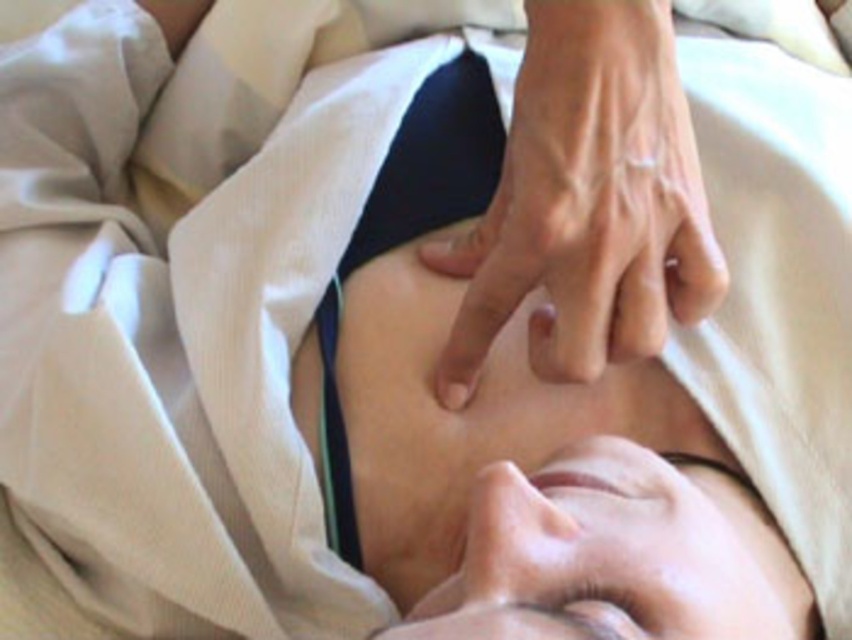
Which is behind, point (637, 192) or point (637, 614)?

Point (637, 192)

Based on the photo, which is more to the left, smooth skin hand at center or brown matte eye at upper center?

Positioned to the left is brown matte eye at upper center.

Image resolution: width=852 pixels, height=640 pixels. What do you see at coordinates (586, 202) in the screenshot?
I see `smooth skin hand at center` at bounding box center [586, 202].

The height and width of the screenshot is (640, 852). I want to click on smooth skin hand at center, so click(x=586, y=202).

Is point (545, 602) positioned after point (612, 611)?

Yes, point (545, 602) is behind point (612, 611).

Can you confirm if smooth skin head at center is thinner than brown matte eye at upper center?

In fact, smooth skin head at center might be wider than brown matte eye at upper center.

At what (x,y) coordinates should I click in order to perform the action: click on smooth skin head at center. Please return your answer as a coordinate pair (x, y). Looking at the image, I should click on (614, 556).

This screenshot has height=640, width=852. I want to click on smooth skin head at center, so click(x=614, y=556).

Can you confirm if smooth skin hand at center is positioned to the right of smooth skin head at center?

In fact, smooth skin hand at center is to the left of smooth skin head at center.

In order to click on smooth skin hand at center in this screenshot , I will do `click(586, 202)`.

Where is `smooth skin hand at center`? The width and height of the screenshot is (852, 640). smooth skin hand at center is located at coordinates (586, 202).